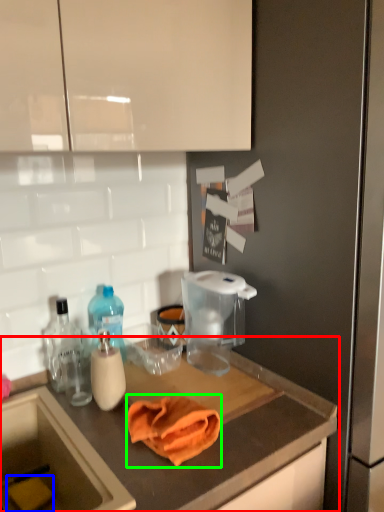
Question: Which object is the farthest from countertop (highlighted by a red box)? Choose among these: food (highlighted by a blue box) or bath towel (highlighted by a green box).

Choices:
 (A) food
 (B) bath towel

Answer: (A)